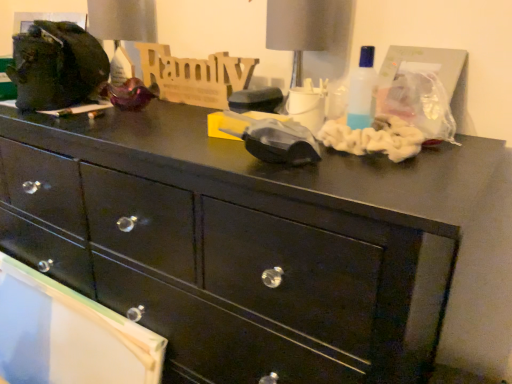
Where is `matte white table lamp at upper left`? matte white table lamp at upper left is located at coordinates (122, 20).

The height and width of the screenshot is (384, 512). What do you see at coordinates (122, 20) in the screenshot? I see `matte white table lamp at upper left` at bounding box center [122, 20].

From the picture: Measure the distance between matte white table lamp at upper left and camera.

A distance of 4.19 feet exists between matte white table lamp at upper left and camera.

Where is `matte white table lamp at upper left`? The image size is (512, 384). matte white table lamp at upper left is located at coordinates (122, 20).